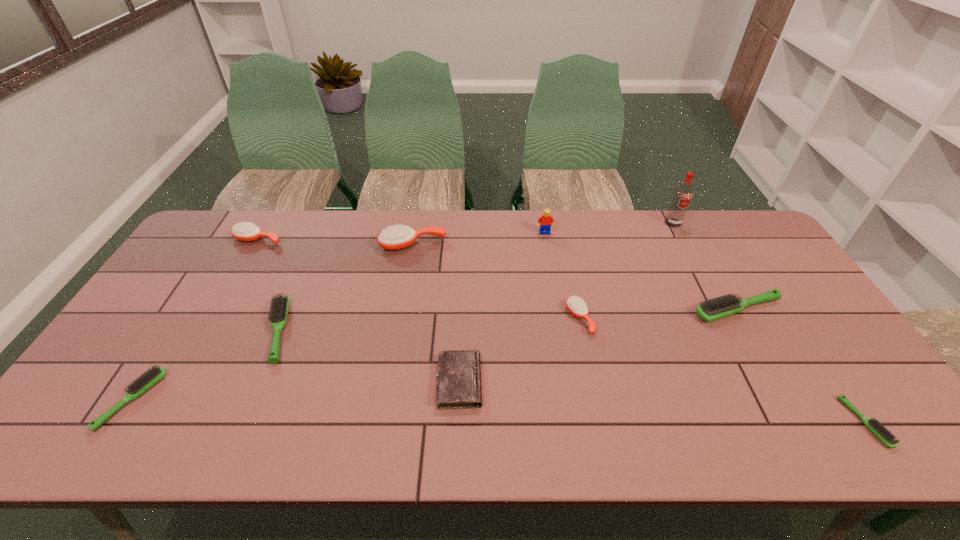
Where is `the tallest object`? the tallest object is located at coordinates (683, 193).

Where is `vodka`? vodka is located at coordinates (683, 193).

The height and width of the screenshot is (540, 960). I want to click on Lego, so click(x=544, y=222).

The width and height of the screenshot is (960, 540). Identify the location of the ninth shortest object. (544, 222).

Find the location of a particular element. The height and width of the screenshot is (540, 960). the fourth object from left to right is located at coordinates (398, 237).

At what (x,y) coordinates should I click in order to perform the action: click on the fourth hairbrush from left to right. Please return your answer as a coordinate pair (x, y). The image size is (960, 540). Looking at the image, I should click on (398, 237).

I want to click on the second biggest orange hairbrush, so [x=244, y=231].

Locate an element on the screen. This screenshot has width=960, height=540. the biggest light hairbrush is located at coordinates (712, 309).

At what (x,y) coordinates should I click in order to perform the action: click on the third object from left to right. Please return your answer as a coordinate pair (x, y). Looking at the image, I should click on (280, 304).

Locate an element on the screen. Image resolution: width=960 pixels, height=540 pixels. the third light hairbrush from right to left is located at coordinates (280, 304).